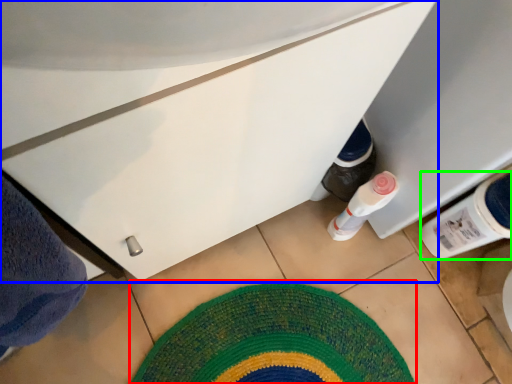
Question: Considering the real-world distances, which object is farthest from mat (highlighted by a red box)? cabinetry (highlighted by a blue box) or bottle (highlighted by a green box)?

Choices:
 (A) cabinetry
 (B) bottle

Answer: (A)